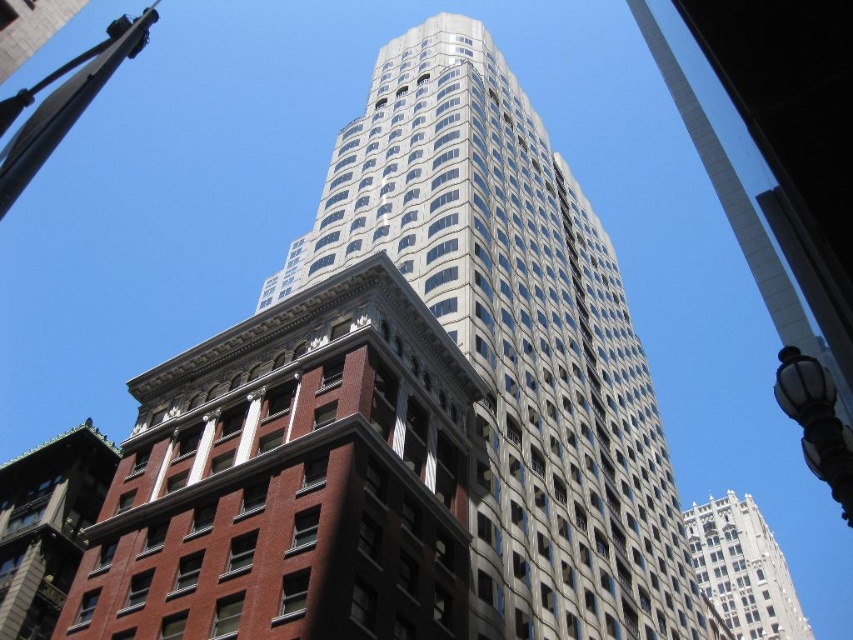
Question: Which point appears closest to the camera in this image?

Choices:
 (A) (64, 444)
 (B) (405, 83)
 (C) (840, 480)

Answer: (C)

Question: Is white stone tower at upper center further to camera compared to black glass streetlight at lower right?

Choices:
 (A) no
 (B) yes

Answer: (B)

Question: Considering the relative positions of red brick building at lower left and black glass streetlight at lower right in the image provided, where is red brick building at lower left located with respect to black glass streetlight at lower right?

Choices:
 (A) above
 (B) below

Answer: (A)

Question: Which of these objects is positioned closest to the white stone tower at upper center?

Choices:
 (A) red brick building at lower left
 (B) glassy reflective skyscraper at center
 (C) black glass streetlight at lower right

Answer: (B)

Question: Among these objects, which one is nearest to the camera?

Choices:
 (A) black glass streetlight at lower right
 (B) glassy reflective skyscraper at center

Answer: (A)

Question: Does glassy reflective skyscraper at center appear under black glass streetlight at lower right?

Choices:
 (A) yes
 (B) no

Answer: (B)